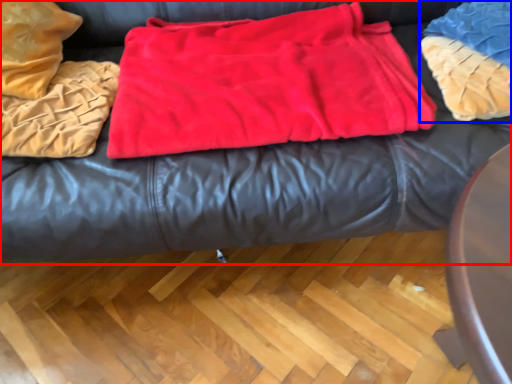
Question: Which object is further to the camera taking this photo, furniture (highlighted by a red box) or cloth (highlighted by a blue box)?

Choices:
 (A) furniture
 (B) cloth

Answer: (B)